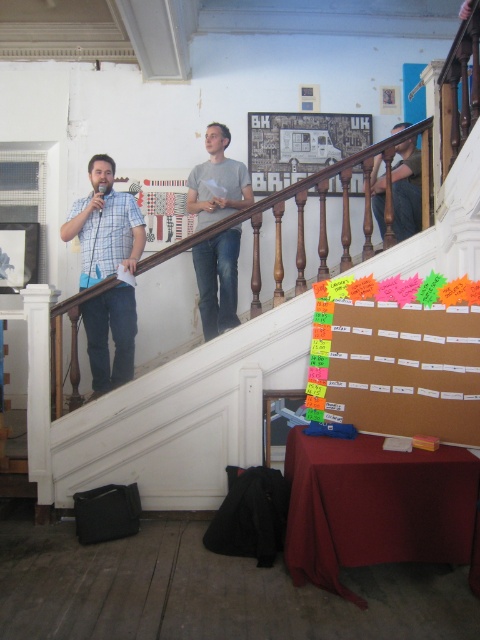
Question: Does matte blue shirt at center have a lesser width compared to brown leather jacket at upper right?

Choices:
 (A) no
 (B) yes

Answer: (A)

Question: From the image, what is the correct spatial relationship of matte blue shirt at center in relation to gray matte shirt at upper center?

Choices:
 (A) below
 (B) above

Answer: (A)

Question: Which object is the closest to the gray matte shirt at upper center?

Choices:
 (A) neon paper notes at upper right
 (B) matte blue shirt at center
 (C) brown leather jacket at upper right

Answer: (B)

Question: Which is farther from the neon paper notes at upper right?

Choices:
 (A) gray matte shirt at upper center
 (B) matte blue shirt at center
 (C) brown leather jacket at upper right

Answer: (B)

Question: Does neon paper notes at upper right appear on the left side of brown leather jacket at upper right?

Choices:
 (A) yes
 (B) no

Answer: (A)

Question: Which point is farther to the camera?

Choices:
 (A) matte blue shirt at center
 (B) neon paper notes at upper right
 (C) gray matte shirt at upper center

Answer: (C)